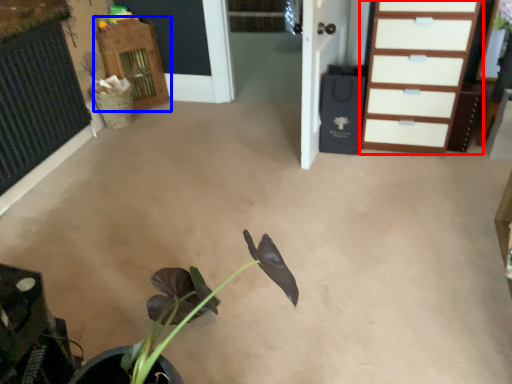
Question: Which of the following is the closest to the observer, chest of drawers (highlighted by a red box) or dresser (highlighted by a blue box)?

Choices:
 (A) chest of drawers
 (B) dresser

Answer: (A)